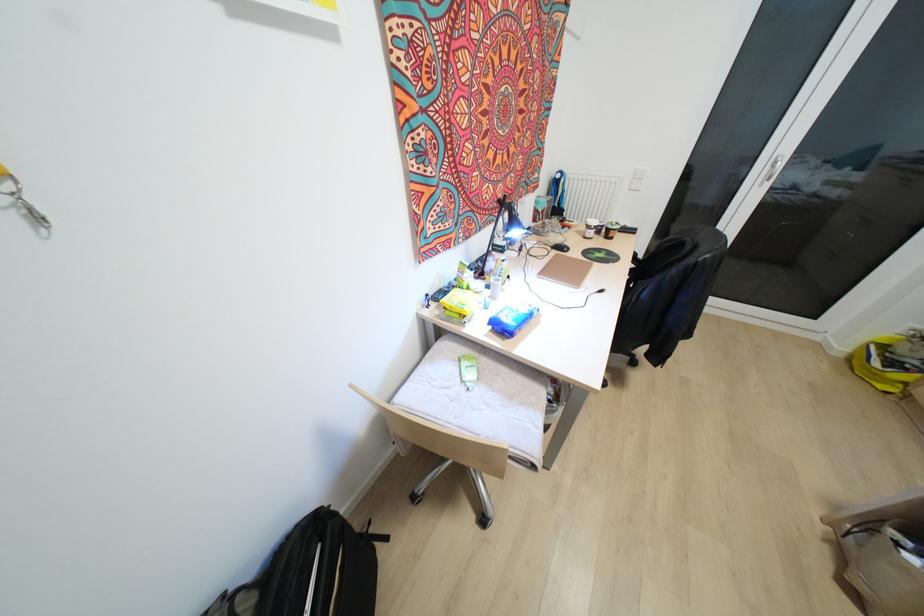
Identify the location of black lamp head. Image resolution: width=924 pixels, height=616 pixels. tap(507, 213).